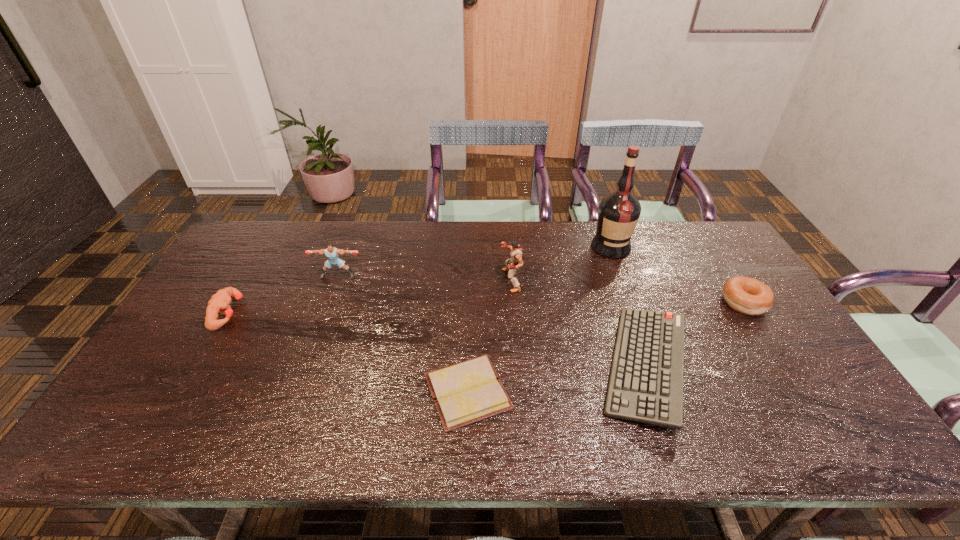
At what (x,y) coordinates should I click in order to perform the action: click on diary. Please return your answer as a coordinate pair (x, y). The width and height of the screenshot is (960, 540). Looking at the image, I should click on (463, 393).

The image size is (960, 540). I want to click on free location located 0.330m on the surface of the farthest object, so click(x=642, y=333).

Where is `free space located 0.060m on the front-facing side of the tallest puncher`? free space located 0.060m on the front-facing side of the tallest puncher is located at coordinates (482, 280).

Where is `free space located 0.140m on the front-facing side of the tallest puncher`? The width and height of the screenshot is (960, 540). free space located 0.140m on the front-facing side of the tallest puncher is located at coordinates (456, 280).

The image size is (960, 540). I want to click on vacant space located on the front-facing side of the tallest puncher, so click(x=475, y=280).

Where is `vacant area situated 0.230m on the front-facing side of the second tallest puncher`? The height and width of the screenshot is (540, 960). vacant area situated 0.230m on the front-facing side of the second tallest puncher is located at coordinates (317, 334).

Identify the location of vacant position located with the gloves of the leftmost object facing forward. The height and width of the screenshot is (540, 960). (314, 313).

The image size is (960, 540). I want to click on vacant space located 0.280m on the left of the bagel, so click(629, 302).

Identify the location of free region located on the right of the computer keyboard. (804, 367).

You are a GUI agent. You are given a task and a screenshot of the screen. Output one action in this format:
    pyautogui.click(x=<x>, y=<y>)
    Task: Click on the vacant space located on the back of the diary
    The width and height of the screenshot is (960, 540).
    Given the screenshot: What is the action you would take?
    pyautogui.click(x=469, y=315)